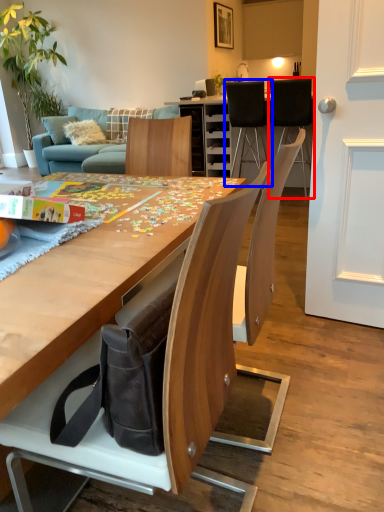
Question: Which point is closer to the camera, chair (highlighted by a red box) or chair (highlighted by a blue box)?

Choices:
 (A) chair
 (B) chair

Answer: (A)